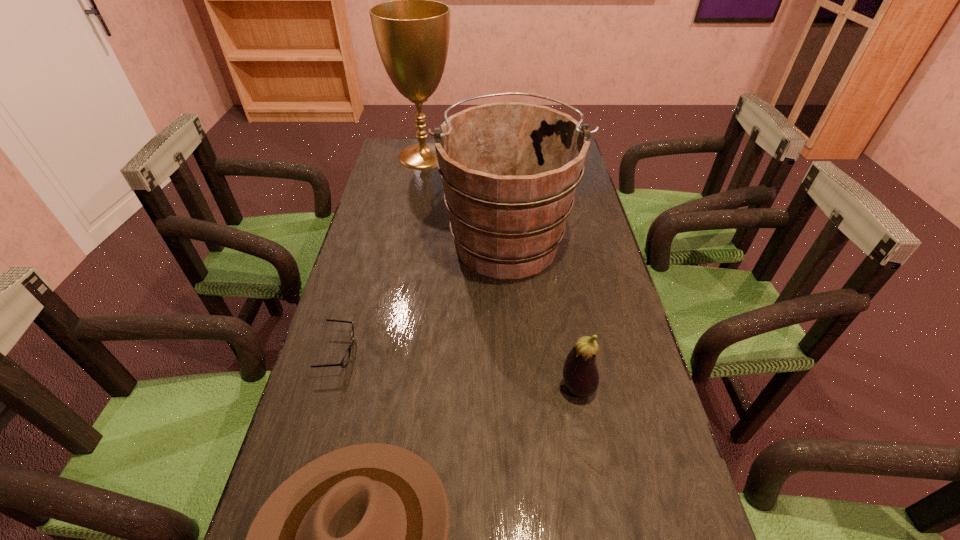
Where is `free space located 0.240m on the back of the third tallest object`? free space located 0.240m on the back of the third tallest object is located at coordinates (562, 298).

The width and height of the screenshot is (960, 540). I want to click on free spot located on the front-facing side of the spectacles, so click(x=504, y=353).

You are a GUI agent. You are given a task and a screenshot of the screen. Output one action in this format:
    pyautogui.click(x=<x>, y=<y>)
    Task: Click on the object that is at the far edge
    
    Given the screenshot: What is the action you would take?
    pyautogui.click(x=412, y=33)

Identify the location of trophy cup situated at the left edge. (412, 33).

Locate an element on the screen. This screenshot has width=960, height=540. spectacles situated at the left edge is located at coordinates (344, 362).

I want to click on bucket located in the right edge section of the desktop, so (x=509, y=170).

The height and width of the screenshot is (540, 960). What are the coordinates of `eggplant present at the right edge` in the screenshot? It's located at (580, 373).

Where is `object at the far left corner`? This screenshot has width=960, height=540. object at the far left corner is located at coordinates (412, 33).

I want to click on free space at the left edge of the desktop, so click(341, 375).

What are the coordinates of `vacant space at the right edge of the desktop` in the screenshot? It's located at (601, 279).